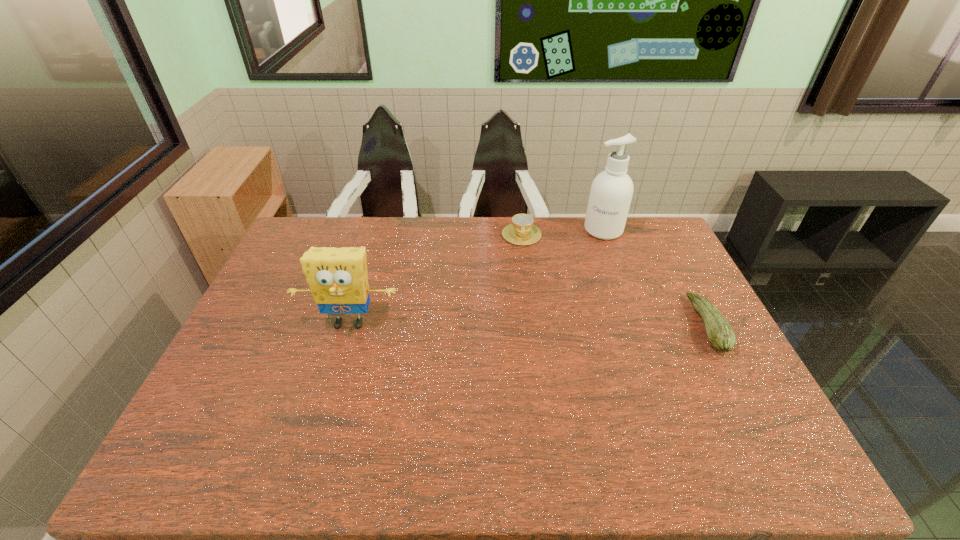
Find the location of a particular element. The height and width of the screenshot is (540, 960). free space that satisfies the following two spatial constraints: 1. on the front side of the rightmost object; 2. at the stem end of the cup is located at coordinates (533, 325).

You are a GUI agent. You are given a task and a screenshot of the screen. Output one action in this format:
    pyautogui.click(x=<x>, y=<y>)
    Task: Click on the vacant space that satisfies the following two spatial constraints: 1. on the front side of the zucchini; 2. at the stem end of the cleansing agent
    
    Given the screenshot: What is the action you would take?
    pyautogui.click(x=638, y=325)

This screenshot has width=960, height=540. Identify the location of free space that satisfies the following two spatial constraints: 1. on the face of the rightmost object; 2. at the stem end of the second tallest object. (348, 325).

The width and height of the screenshot is (960, 540). What are the coordinates of `vacant region that satisfies the following two spatial constraints: 1. on the face of the zucchini; 2. at the stem end of the leftmost object` in the screenshot? It's located at point(348,325).